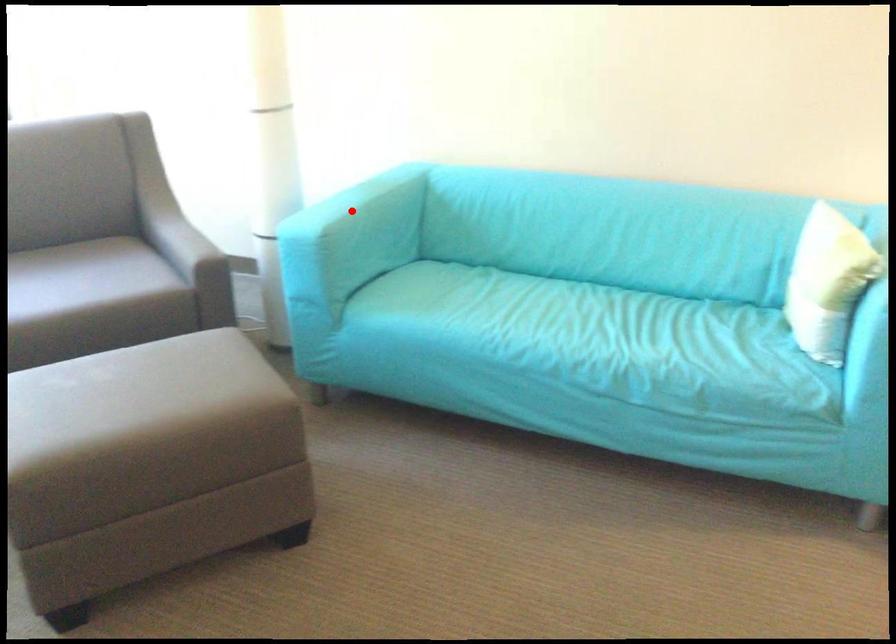
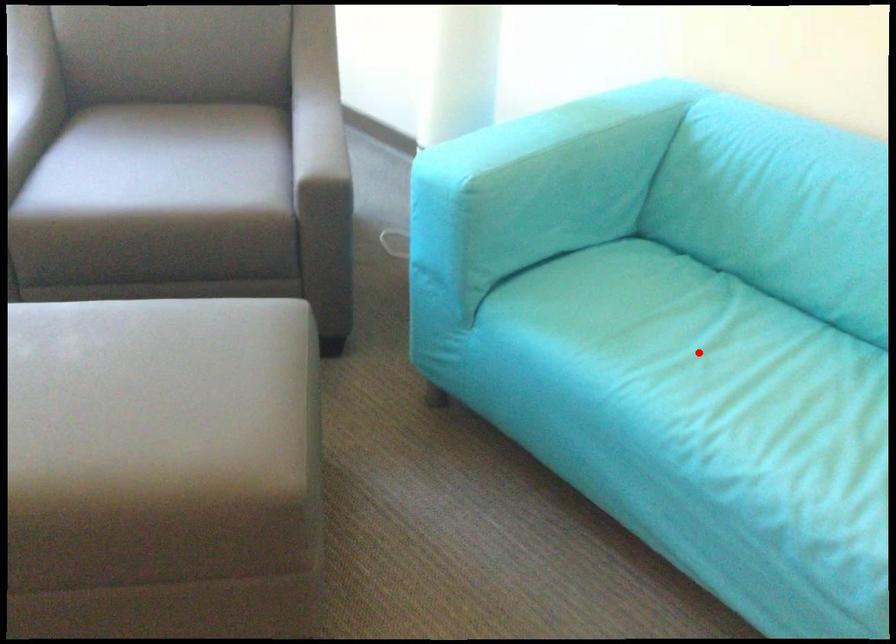
I am providing you with two images of the same scene from different viewpoints. A red point is marked on the first image and another point is marked on the second image. Is the marked point in image1 the same physical position as the marked point in image2?

No